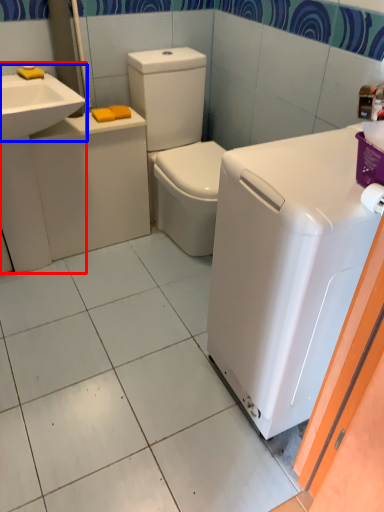
Question: Which point is further to the camera, sink (highlighted by a red box) or sink (highlighted by a blue box)?

Choices:
 (A) sink
 (B) sink

Answer: (A)